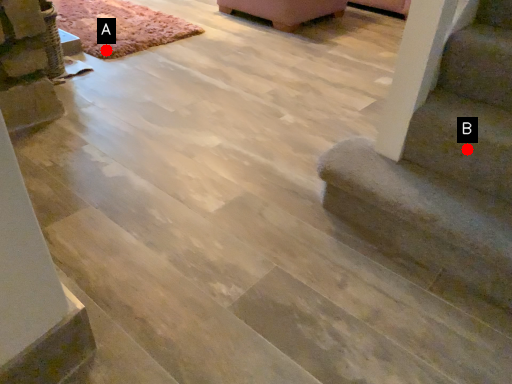
Question: Two points are circled on the image, labeled by A and B beside each circle. Which point is further to the camera?

Choices:
 (A) A is further
 (B) B is further

Answer: (A)